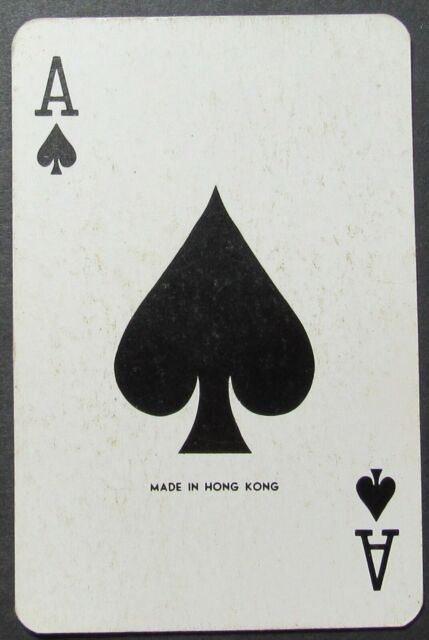
Locate an element on the screen. This screenshot has width=429, height=640. curved corner is located at coordinates (21, 621), (17, 29), (398, 24), (413, 611).